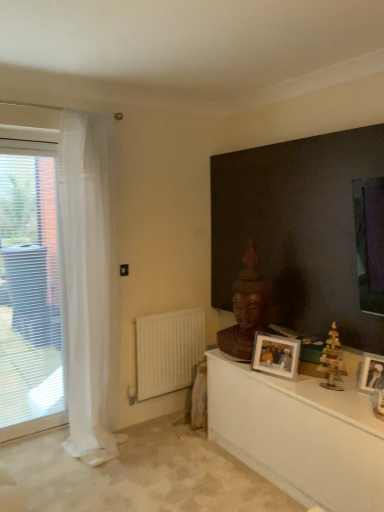
Question: Does wooden toy at right have a larger size compared to white sheer curtain at left?

Choices:
 (A) yes
 (B) no

Answer: (B)

Question: From the image's perspective, is wooden toy at right located beneath white sheer curtain at left?

Choices:
 (A) yes
 (B) no

Answer: (A)

Question: Can we say wooden toy at right lies outside white sheer curtain at left?

Choices:
 (A) no
 (B) yes

Answer: (B)

Question: From the image's perspective, would you say wooden toy at right is positioned over white sheer curtain at left?

Choices:
 (A) no
 (B) yes

Answer: (A)

Question: Can you confirm if wooden toy at right is positioned to the right of white sheer curtain at left?

Choices:
 (A) no
 (B) yes

Answer: (B)

Question: Can you confirm if wooden toy at right is wider than white sheer curtain at left?

Choices:
 (A) no
 (B) yes

Answer: (A)

Question: Would you say brown wooden statue at center is outside white glossy table at lower right?

Choices:
 (A) yes
 (B) no

Answer: (A)

Question: Considering the relative sizes of brown wooden statue at center and white glossy table at lower right in the image provided, is brown wooden statue at center smaller than white glossy table at lower right?

Choices:
 (A) yes
 (B) no

Answer: (A)

Question: Considering the relative positions of brown wooden statue at center and white glossy table at lower right in the image provided, is brown wooden statue at center behind white glossy table at lower right?

Choices:
 (A) yes
 (B) no

Answer: (A)

Question: Is brown wooden statue at center taller than white glossy table at lower right?

Choices:
 (A) yes
 (B) no

Answer: (A)

Question: Is brown wooden statue at center positioned with its back to white glossy table at lower right?

Choices:
 (A) yes
 (B) no

Answer: (B)

Question: From a real-world perspective, is brown wooden statue at center located beneath white glossy table at lower right?

Choices:
 (A) yes
 (B) no

Answer: (B)

Question: From a real-world perspective, is white matte radiator at lower left on metallic silver photo frame at right, the 2th picture frame positioned from the back?

Choices:
 (A) yes
 (B) no

Answer: (B)